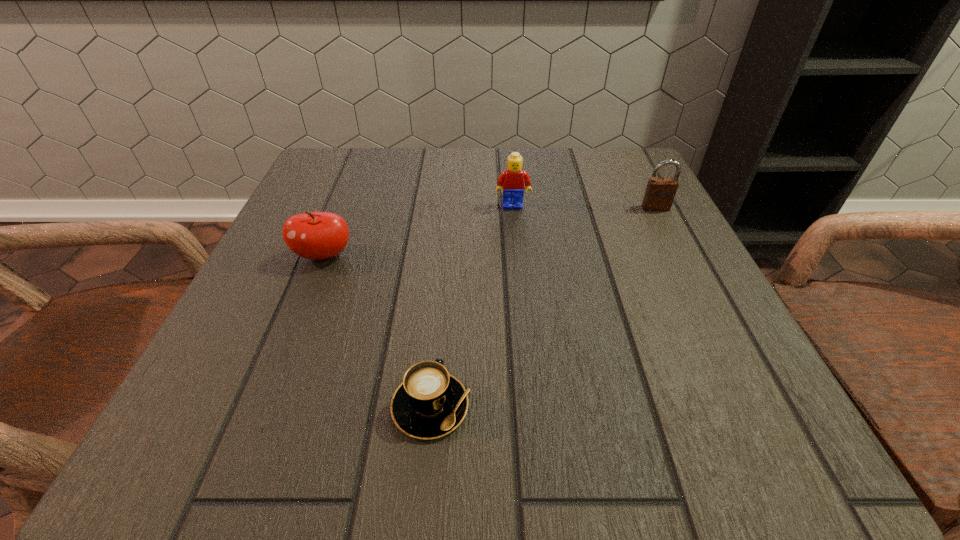
This screenshot has width=960, height=540. Identify the location of Lego. (511, 179).

Image resolution: width=960 pixels, height=540 pixels. What are the coordinates of `padlock` in the screenshot? It's located at (659, 195).

Where is `the leftmost object`? The height and width of the screenshot is (540, 960). the leftmost object is located at coordinates [x=311, y=235].

Where is `the second nearest object`? This screenshot has width=960, height=540. the second nearest object is located at coordinates (311, 235).

Identify the location of cappuccino. This screenshot has height=540, width=960. (430, 403).

The height and width of the screenshot is (540, 960). Find the location of `the shortest object`. the shortest object is located at coordinates (430, 403).

This screenshot has width=960, height=540. I want to click on vacant space positioned on the front-facing side of the Lego, so (x=518, y=263).

Image resolution: width=960 pixels, height=540 pixels. I want to click on vacant space located on the front-facing side of the padlock, so click(707, 307).

This screenshot has width=960, height=540. Find the location of `vacant space located on the back of the apple`. vacant space located on the back of the apple is located at coordinates (358, 171).

The image size is (960, 540). I want to click on free space located 0.330m on the right of the nearest object, so click(732, 406).